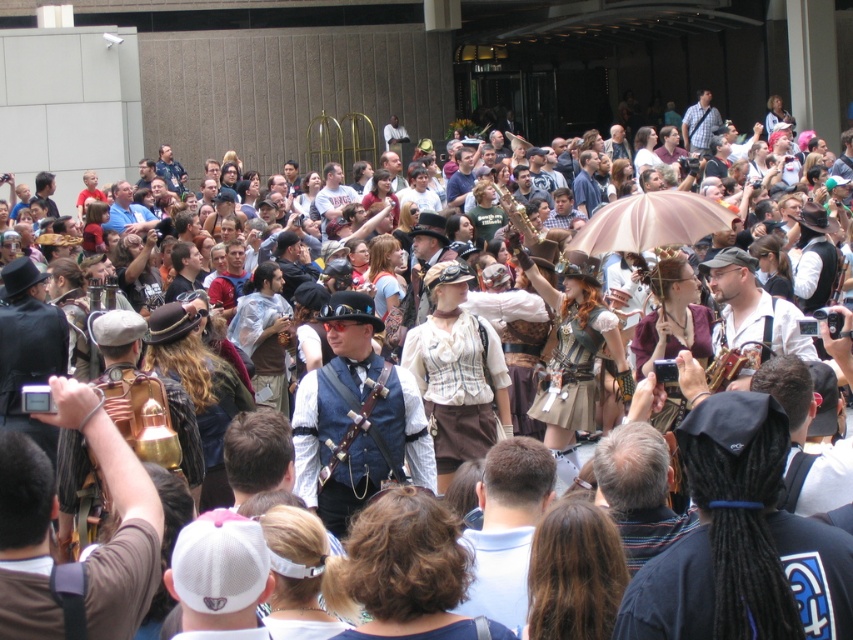
Can you confirm if white textured blouse at center is taller than matte blue shirt at center?

Correct, white textured blouse at center is much taller as matte blue shirt at center.

From the picture: Who is positioned more to the right, white textured blouse at center or matte blue shirt at center?

white textured blouse at center

Is point (463, 376) positioned behind point (144, 220)?

No, (463, 376) is closer to viewer.

Where is `white textured blouse at center`? white textured blouse at center is located at coordinates (457, 385).

Does point (337, 403) come behind point (335, 177)?

No, it is not.

What do you see at coordinates (357, 419) in the screenshot? The image size is (853, 640). I see `matte blue vest at center` at bounding box center [357, 419].

Is point (323, 387) closer to camera compared to point (335, 209)?

Yes, point (323, 387) is in front of point (335, 209).

You are a GUI agent. You are given a task and a screenshot of the screen. Output one action in this format:
    pyautogui.click(x=<x>, y=<y>)
    Task: Click on the matte blue vest at center
    The image size is (853, 640).
    Given the screenshot: What is the action you would take?
    pyautogui.click(x=357, y=419)

Does plaid shirt at upper center have a lesser height compared to matte black hat at upper center?

Yes, plaid shirt at upper center is shorter than matte black hat at upper center.

You are a GUI agent. You are given a task and a screenshot of the screen. Output one action in this format:
    pyautogui.click(x=<x>, y=<y>)
    Task: Click on the plaid shirt at upper center
    The image size is (853, 640).
    Given the screenshot: What is the action you would take?
    pyautogui.click(x=699, y=122)

Which is behind, point (686, 131) or point (163, 168)?

Positioned behind is point (686, 131).

Locate an element on the screen. plaid shirt at upper center is located at coordinates (699, 122).